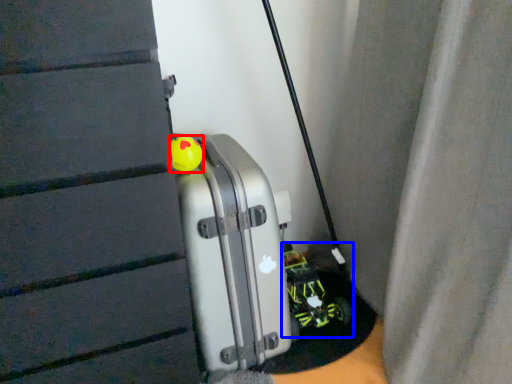
Question: Which of the following is the farthest to the observer, toy (highlighted by a red box) or toy car (highlighted by a blue box)?

Choices:
 (A) toy
 (B) toy car

Answer: (B)